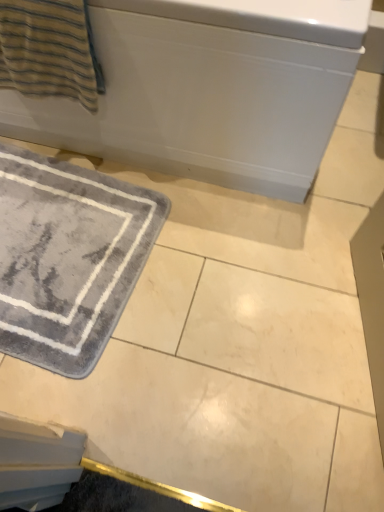
Question: Is gray plush bath mat at lower left further to camera compared to white glossy bathtub at upper center?

Choices:
 (A) yes
 (B) no

Answer: (A)

Question: Can you confirm if gray plush bath mat at lower left is smaller than white glossy bathtub at upper center?

Choices:
 (A) no
 (B) yes

Answer: (B)

Question: Can we say gray plush bath mat at lower left lies outside white glossy bathtub at upper center?

Choices:
 (A) no
 (B) yes

Answer: (B)

Question: Is gray plush bath mat at lower left not near white glossy bathtub at upper center?

Choices:
 (A) no
 (B) yes

Answer: (A)

Question: Does gray plush bath mat at lower left have a lesser height compared to white glossy bathtub at upper center?

Choices:
 (A) yes
 (B) no

Answer: (A)

Question: Is point (264, 74) closer or farther from the camera than point (77, 71)?

Choices:
 (A) closer
 (B) farther

Answer: (A)

Question: Would you say white glossy bathtub at upper center is inside or outside striped cotton towel at upper left?

Choices:
 (A) outside
 (B) inside

Answer: (A)

Question: Considering the positions of white glossy bathtub at upper center and striped cotton towel at upper left in the image, is white glossy bathtub at upper center taller or shorter than striped cotton towel at upper left?

Choices:
 (A) short
 (B) tall

Answer: (B)

Question: From a real-world perspective, is white glossy bathtub at upper center above or below striped cotton towel at upper left?

Choices:
 (A) above
 (B) below

Answer: (B)

Question: In terms of width, does white glossy bathtub at upper center look wider or thinner when compared to gray plush bath mat at lower left?

Choices:
 (A) thin
 (B) wide

Answer: (B)

Question: Is white glossy bathtub at upper center in front of or behind gray plush bath mat at lower left in the image?

Choices:
 (A) front
 (B) behind

Answer: (A)

Question: From the image's perspective, is white glossy bathtub at upper center positioned above or below gray plush bath mat at lower left?

Choices:
 (A) below
 (B) above

Answer: (B)

Question: From a real-world perspective, is white glossy bathtub at upper center above or below gray plush bath mat at lower left?

Choices:
 (A) above
 (B) below

Answer: (A)

Question: Is point (44, 329) positioned closer to the camera than point (44, 3)?

Choices:
 (A) farther
 (B) closer

Answer: (A)

Question: Relative to striped cotton towel at upper left, is gray plush bath mat at lower left in front or behind?

Choices:
 (A) behind
 (B) front

Answer: (A)